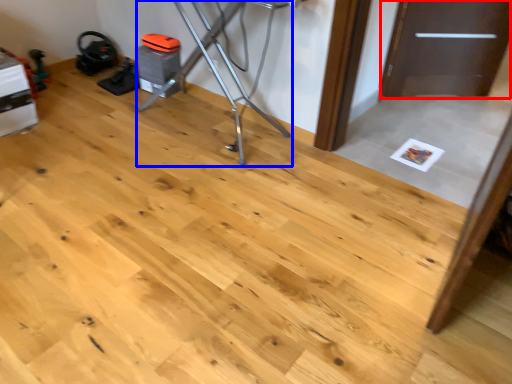
Question: Which point is further to the camera, door (highlighted by a red box) or furniture (highlighted by a blue box)?

Choices:
 (A) door
 (B) furniture

Answer: (A)